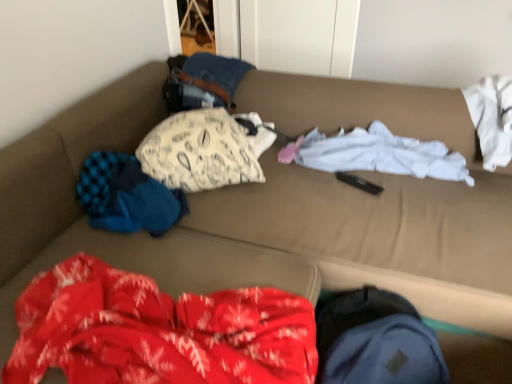
Question: Is white cotton shirt at center, the first clothing in the right-to-left sequence, in front of or behind blue knitted sweater at left, marked as the 1th clothing in a left-to-right arrangement, in the image?

Choices:
 (A) behind
 (B) front

Answer: (A)

Question: From a real-world perspective, is white cotton shirt at center, which appears as the 3th clothing when viewed from the left, physically located above or below blue knitted sweater at left, the 3th clothing when ordered from right to left?

Choices:
 (A) above
 (B) below

Answer: (B)

Question: Which is farther from the white printed pillow at center, the 2th clothing positioned from the left?

Choices:
 (A) white cotton shirt at center, the first clothing in the right-to-left sequence
 (B) blue knitted sweater at left, marked as the 1th clothing in a left-to-right arrangement

Answer: (A)

Question: Which object is positioned closest to the white printed pillow at center, the 2th clothing positioned from the left?

Choices:
 (A) blue knitted sweater at left, marked as the 1th clothing in a left-to-right arrangement
 (B) white cotton shirt at center, the first clothing in the right-to-left sequence

Answer: (A)